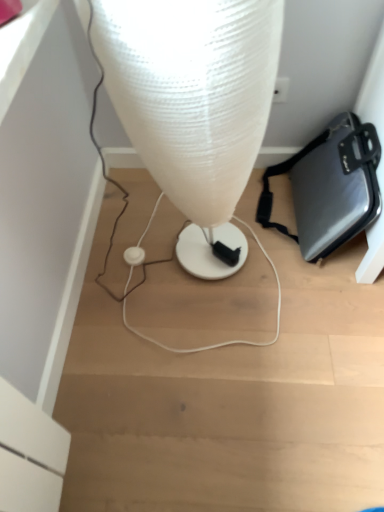
Describe the element at coordinates (329, 187) in the screenshot. This screenshot has height=512, width=384. I see `metallic gray briefcase at lower right` at that location.

Where is `translucent plastic lamp at center`? The width and height of the screenshot is (384, 512). translucent plastic lamp at center is located at coordinates (193, 103).

Which object is further away from the camera, translucent plastic lamp at center or metallic gray briefcase at lower right?

metallic gray briefcase at lower right is more distant.

Is there a large distance between translucent plastic lamp at center and metallic gray briefcase at lower right?

They are positioned close to each other.

Would you say translucent plastic lamp at center contains metallic gray briefcase at lower right?

No, metallic gray briefcase at lower right is located outside of translucent plastic lamp at center.

In terms of height, does translucent plastic lamp at center look taller or shorter compared to metallic gray briefcase at lower right?

Clearly, translucent plastic lamp at center is taller compared to metallic gray briefcase at lower right.

Is metallic gray briefcase at lower right a part of white plastic earphone at center?

No.

Would you say white plastic earphone at center is a long distance from metallic gray briefcase at lower right?

They are positioned close to each other.

Where is `earphone lying below the metallic gray briefcase at lower right (from the image's perspective)`? earphone lying below the metallic gray briefcase at lower right (from the image's perspective) is located at coordinates (134, 255).

From the image's perspective, is translucent plastic lamp at center located beneath white plastic earphone at center?

No, from the image's perspective, translucent plastic lamp at center is not below white plastic earphone at center.

This screenshot has height=512, width=384. I want to click on lamp above the white plastic earphone at center (from the image's perspective), so click(x=193, y=103).

How distant is translucent plastic lamp at center from white plastic earphone at center?

translucent plastic lamp at center and white plastic earphone at center are 52.15 centimeters apart from each other.

Is metallic gray briefcase at lower right wider or thinner than translucent plastic lamp at center?

Clearly, metallic gray briefcase at lower right has less width compared to translucent plastic lamp at center.

How far apart are metallic gray briefcase at lower right and translucent plastic lamp at center?

metallic gray briefcase at lower right is 15.18 inches from translucent plastic lamp at center.

Is point (365, 202) positioned behind point (171, 102)?

Yes.

Who is taller, white plastic earphone at center or translucent plastic lamp at center?

translucent plastic lamp at center.

Who is bigger, white plastic earphone at center or translucent plastic lamp at center?

translucent plastic lamp at center is bigger.

Consider the image. From a real-world perspective, which object stands above the other?

translucent plastic lamp at center.

Between white plastic earphone at center and translucent plastic lamp at center, which one has larger width?

translucent plastic lamp at center.

Considering the relative sizes of metallic gray briefcase at lower right and white plastic earphone at center in the image provided, is metallic gray briefcase at lower right wider than white plastic earphone at center?

Indeed, metallic gray briefcase at lower right has a greater width compared to white plastic earphone at center.

Does point (321, 175) come farther from viewer compared to point (144, 254)?

No, it is not.

Can you confirm if metallic gray briefcase at lower right is smaller than white plastic earphone at center?

Incorrect, metallic gray briefcase at lower right is not smaller in size than white plastic earphone at center.

Which is in front, metallic gray briefcase at lower right or white plastic earphone at center?

Positioned in front is metallic gray briefcase at lower right.

This screenshot has width=384, height=512. Find the location of `lamp on the left of the metallic gray briefcase at lower right`. lamp on the left of the metallic gray briefcase at lower right is located at coordinates (193, 103).

Find the location of `handbag located above the white plastic earphone at center (from the image's perspective)`. handbag located above the white plastic earphone at center (from the image's perspective) is located at coordinates (329, 187).

Based on their spatial positions, is metallic gray briefcase at lower right or translucent plastic lamp at center closer to white plastic earphone at center?

Based on the image, translucent plastic lamp at center appears to be nearer to white plastic earphone at center.

Looking at the image, which one is located further to translucent plastic lamp at center, white plastic earphone at center or metallic gray briefcase at lower right?

white plastic earphone at center lies further to translucent plastic lamp at center than the other object.

Based on their spatial positions, is metallic gray briefcase at lower right or white plastic earphone at center further from translucent plastic lamp at center?

Based on the image, white plastic earphone at center appears to be further to translucent plastic lamp at center.

Based on their spatial positions, is white plastic earphone at center or translucent plastic lamp at center further from metallic gray briefcase at lower right?

white plastic earphone at center.

From the image, which object appears to be nearer to metallic gray briefcase at lower right, translucent plastic lamp at center or white plastic earphone at center?

translucent plastic lamp at center lies closer to metallic gray briefcase at lower right than the other object.

From the image, which object appears to be nearer to white plastic earphone at center, translucent plastic lamp at center or metallic gray briefcase at lower right?

translucent plastic lamp at center.

Locate an element on the screen. handbag positioned between translucent plastic lamp at center and white plastic earphone at center from near to far is located at coordinates (329, 187).